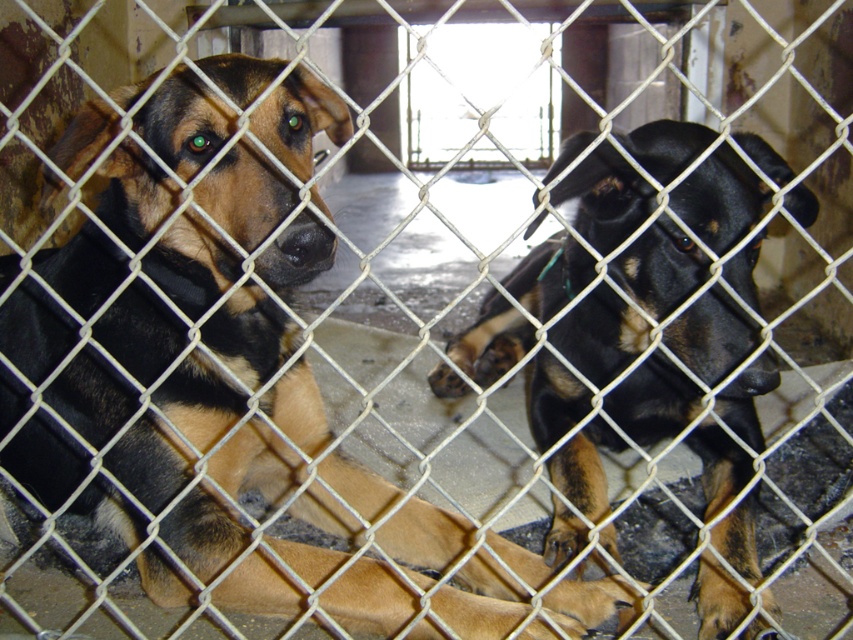
In the scene shown: Can you confirm if black fur dog at left is wider than black glossy dog at center?

Yes, black fur dog at left is wider than black glossy dog at center.

Does black fur dog at left have a larger size compared to black glossy dog at center?

Correct, black fur dog at left is larger in size than black glossy dog at center.

Measure the distance between black fur dog at left and camera.

3.36 feet

Locate an element on the screen. The image size is (853, 640). black fur dog at left is located at coordinates (227, 374).